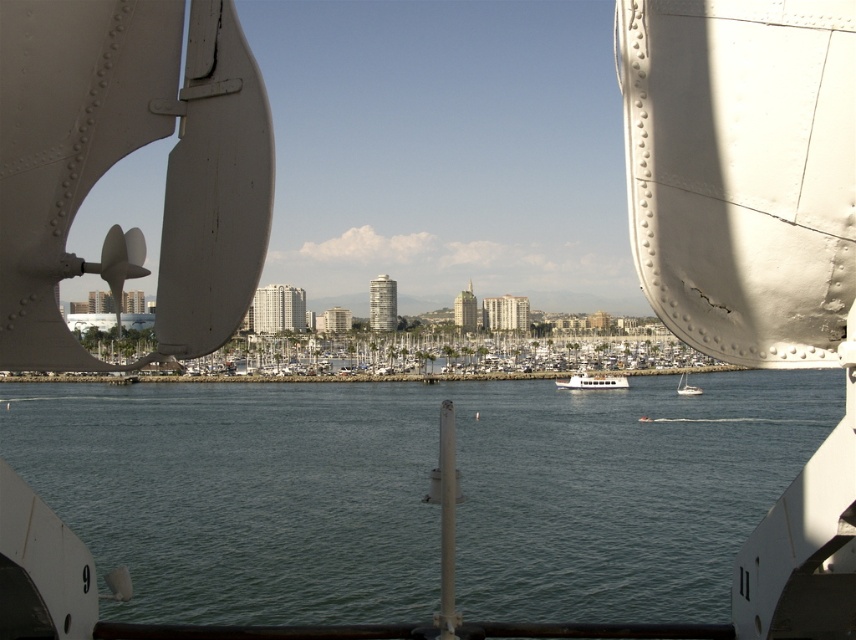
Question: Where is greenish-blue water at center located in relation to white metallic propeller at center in the image?

Choices:
 (A) above
 (B) below

Answer: (B)

Question: Which of these objects is positioned farthest from the greenish-blue water at center?

Choices:
 (A) white glossy boat at center
 (B) white metallic propeller at center
 (C) white matte sailboat at lower right

Answer: (B)

Question: Is greenish-blue water at center above white matte sailboat at lower right?

Choices:
 (A) no
 (B) yes

Answer: (B)

Question: Is greenish-blue water at center wider than white metallic propeller at center?

Choices:
 (A) yes
 (B) no

Answer: (A)

Question: Among these objects, which one is farthest from the camera?

Choices:
 (A) white metallic propeller at center
 (B) white matte sailboat at lower right
 (C) greenish-blue water at center
 (D) white glossy boat at center

Answer: (D)

Question: Which point appears closest to the camera in this image?

Choices:
 (A) (693, 388)
 (B) (138, 64)
 (C) (625, 384)
 (D) (48, 484)

Answer: (B)